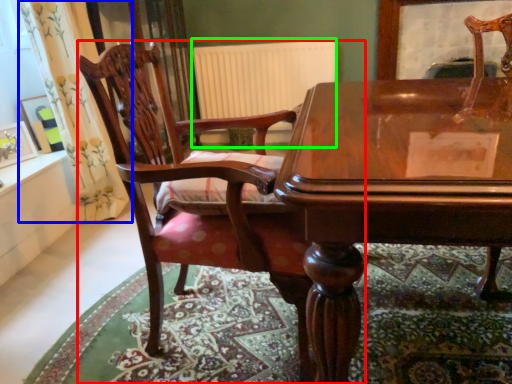
Question: Which object is the farthest from chair (highlighted by a red box)? Choose among these: curtain (highlighted by a blue box) or radiator (highlighted by a green box).

Choices:
 (A) curtain
 (B) radiator

Answer: (B)